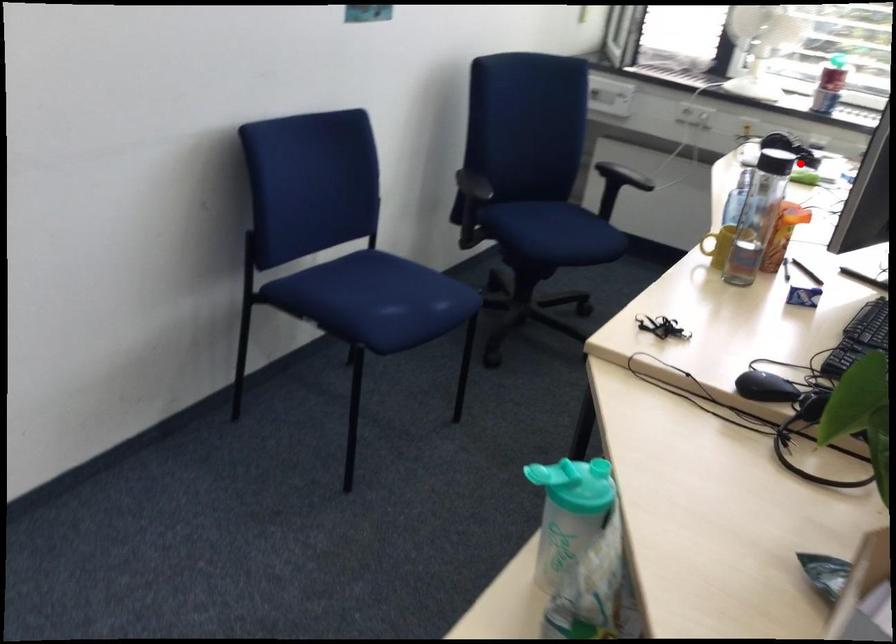
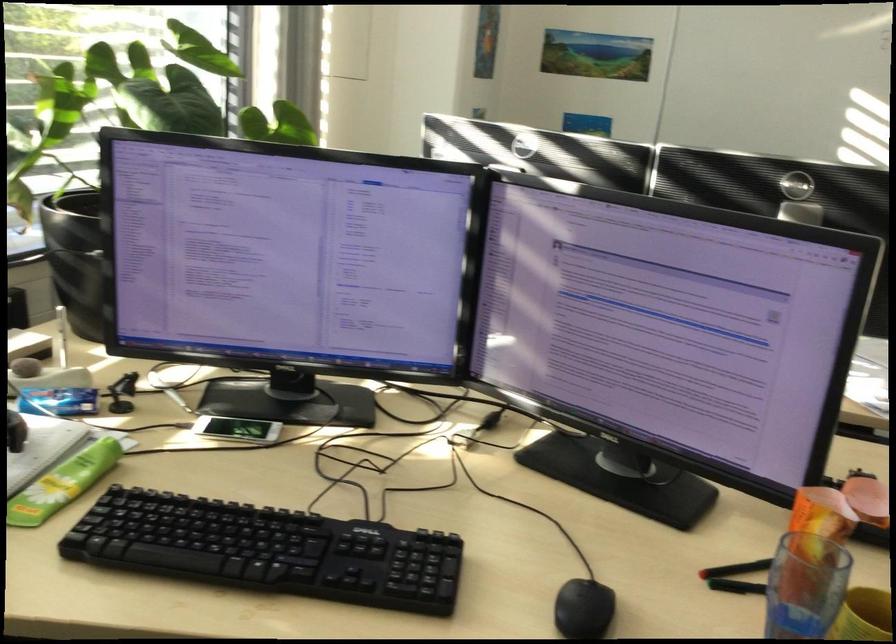
Question: I am providing you with two images of the same scene from different viewpoints. Image1 has a red point marked. In image2, the corresponding 3D location appears at what relative position? Reply with the corresponding letter.

Choices:
 (A) Closer
 (B) Farther

Answer: (A)